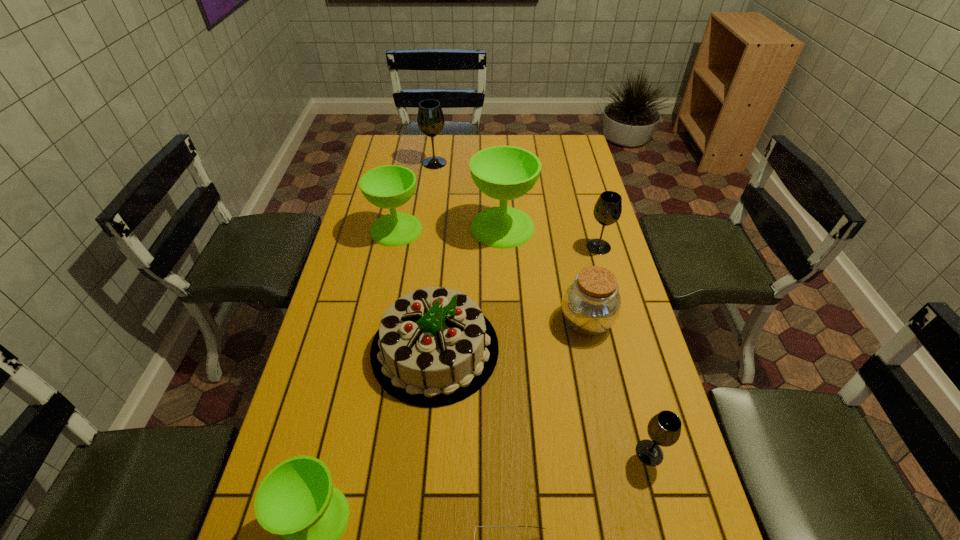
Where is `vacant region between the jar and the biggest green wineglass`? This screenshot has width=960, height=540. vacant region between the jar and the biggest green wineglass is located at coordinates (544, 274).

Locate which object is the closest to the green birthday cake. Please provide its 2D coordinates. Your answer should be formatted as a tuple, i.e. [(x, y)], where the tuple contains the x and y coordinates of a point satisfying the conditions above.

[(591, 304)]

Point out which object is positioned as the fifth nearest to the second smallest gray wineglass. Please provide its 2D coordinates. Your answer should be formatted as a tuple, i.e. [(x, y)], where the tuple contains the x and y coordinates of a point satisfying the conditions above.

[(664, 429)]

You are a GUI agent. You are given a task and a screenshot of the screen. Output one action in this format:
    pyautogui.click(x=<x>, y=<y>)
    Task: Click on the wineglass that is the third nearest to the third wineglass from right to left
    Image resolution: width=960 pixels, height=540 pixels.
    Given the screenshot: What is the action you would take?
    pyautogui.click(x=430, y=118)

In order to click on wineglass that is the closest to the jar in this screenshot , I will do `click(607, 210)`.

Choose which green wineglass is the nearest neighbor to the shortest object. Please provide its 2D coordinates. Your answer should be formatted as a tuple, i.e. [(x, y)], where the tuple contains the x and y coordinates of a point satisfying the conditions above.

[(296, 500)]

Locate an element on the screen. green wineglass that is the second nearest to the green birthday cake is located at coordinates (505, 173).

Identify which gray wineglass is the closest to the nearest gray wineglass. Please provide its 2D coordinates. Your answer should be formatted as a tuple, i.e. [(x, y)], where the tuple contains the x and y coordinates of a point satisfying the conditions above.

[(607, 210)]

Identify which gray wineglass is located as the nearest to the brown jar. Please provide its 2D coordinates. Your answer should be formatted as a tuple, i.e. [(x, y)], where the tuple contains the x and y coordinates of a point satisfying the conditions above.

[(607, 210)]

Find the location of `free location that satisfies the following two spatial constraints: 1. on the front side of the farthest wineglass; 2. on the right side of the birthday cake`. free location that satisfies the following two spatial constraints: 1. on the front side of the farthest wineglass; 2. on the right side of the birthday cake is located at coordinates (410, 349).